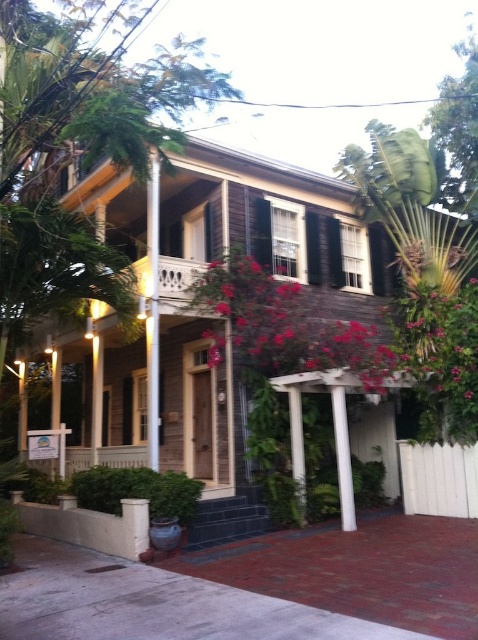
Question: Which object is positioned closest to the white smooth column at center?

Choices:
 (A) pink wood flowers at center
 (B) white smooth pillar at lower center

Answer: (B)

Question: Considering the real-world distances, which object is closest to the white smooth pillar at lower center?

Choices:
 (A) white smooth column at center
 (B) pink wood flowers at center

Answer: (A)

Question: Is pink wood flowers at center in front of green leafy bush at lower center?

Choices:
 (A) no
 (B) yes

Answer: (A)

Question: Is pink wood flowers at center behind white smooth pillar at lower center?

Choices:
 (A) no
 (B) yes

Answer: (B)

Question: Is white painted wood column at center thinner than white smooth column at center?

Choices:
 (A) no
 (B) yes

Answer: (A)

Question: Which of the following is the closest to the observer?

Choices:
 (A) (377, 362)
 (B) (156, 429)
 (C) (347, 428)

Answer: (B)